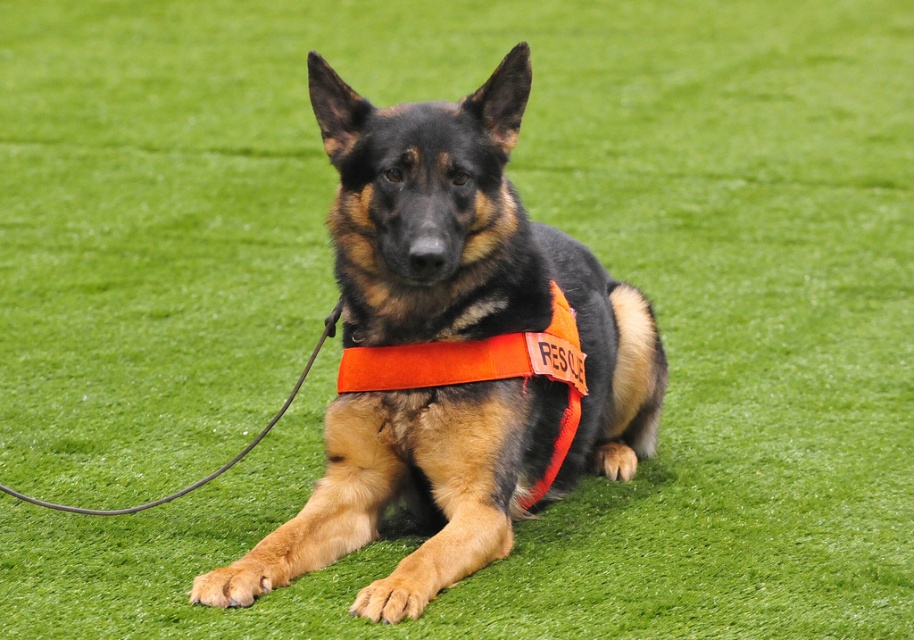
You are a photographer trying to position a small prop exactly where the orange fabric vest at center was in the image. If the image has a coordinate system where the bottom left corner is the origin, what are the coordinates of the point where you should place the prop?

The orange fabric vest at center is located at point (454, 349), so you should place the prop at those coordinates to match its position in the image.

You are a dog trainer assessing the equipment of a German Shepherd. You notice the orange fabric vest at center and the orange fabric neckband at center. Which piece of equipment is located higher on the dog?

The orange fabric vest at center is positioned over the orange fabric neckband at center, so the vest is higher up on the dog.